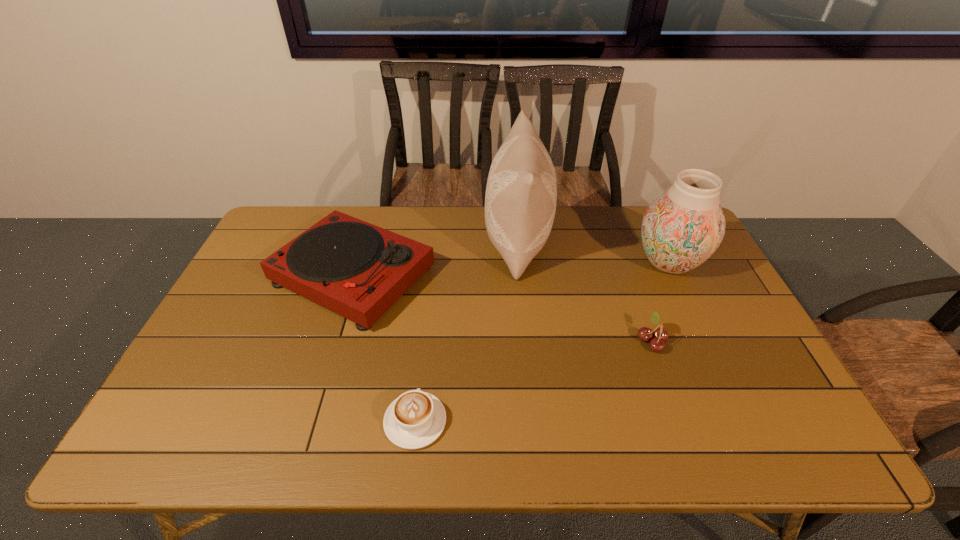
Where is `record player at the far edge`? This screenshot has height=540, width=960. record player at the far edge is located at coordinates (358, 270).

What are the coordinates of `object at the near edge` in the screenshot? It's located at (414, 420).

At what (x,y) coordinates should I click in order to perform the action: click on object present at the left edge. Please return your answer as a coordinate pair (x, y). Image resolution: width=960 pixels, height=540 pixels. Looking at the image, I should click on (358, 270).

Identify the location of object at the right edge. The height and width of the screenshot is (540, 960). (683, 227).

Locate an element on the screen. object that is positioned at the far left corner is located at coordinates tap(358, 270).

Image resolution: width=960 pixels, height=540 pixels. I want to click on object present at the far right corner, so click(683, 227).

I want to click on free region at the far edge of the desktop, so click(x=385, y=215).

In the image, there is a desktop. Find the location of `free space at the near edge`. free space at the near edge is located at coordinates (372, 437).

At what (x,y) coordinates should I click in order to perform the action: click on free space at the left edge of the desktop. Please return your answer as a coordinate pair (x, y). This screenshot has height=540, width=960. Looking at the image, I should click on (226, 345).

Identify the location of free space at the right edge of the desktop. The image size is (960, 540). (711, 316).